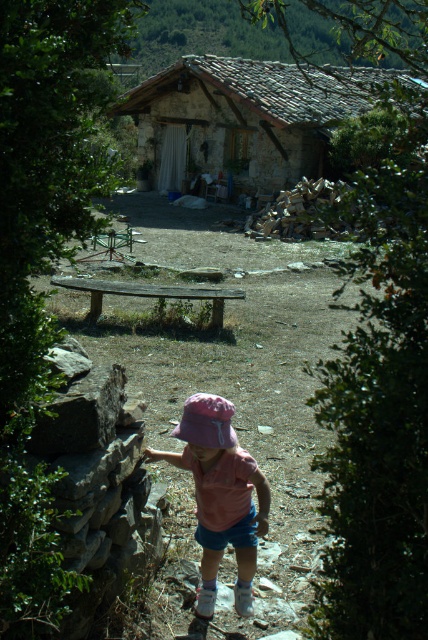
Question: Does rustic stone hut at center appear over pink fabric hat at center?

Choices:
 (A) no
 (B) yes

Answer: (B)

Question: From the image, what is the correct spatial relationship of rustic stone hut at center in relation to pink fabric hat at center?

Choices:
 (A) below
 (B) above

Answer: (B)

Question: Among these points, which one is farthest from the camera?

Choices:
 (A) (219, 124)
 (B) (202, 404)
 (C) (217, 417)

Answer: (A)

Question: Which object is farther from the camera taking this photo?

Choices:
 (A) rustic stone hut at center
 (B) purple fabric hat at lower center
 (C) pink fabric hat at center

Answer: (A)

Question: Is rustic stone hut at center below purple fabric hat at lower center?

Choices:
 (A) yes
 (B) no

Answer: (B)

Question: Which object is closer to the camera taking this photo?

Choices:
 (A) purple fabric hat at lower center
 (B) pink fabric hat at center
 (C) rustic stone hut at center

Answer: (B)